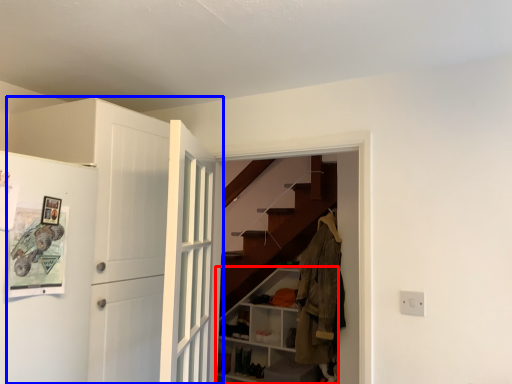
Question: Which point is closer to the camera, cabinetry (highlighted by a red box) or door (highlighted by a blue box)?

Choices:
 (A) cabinetry
 (B) door

Answer: (B)